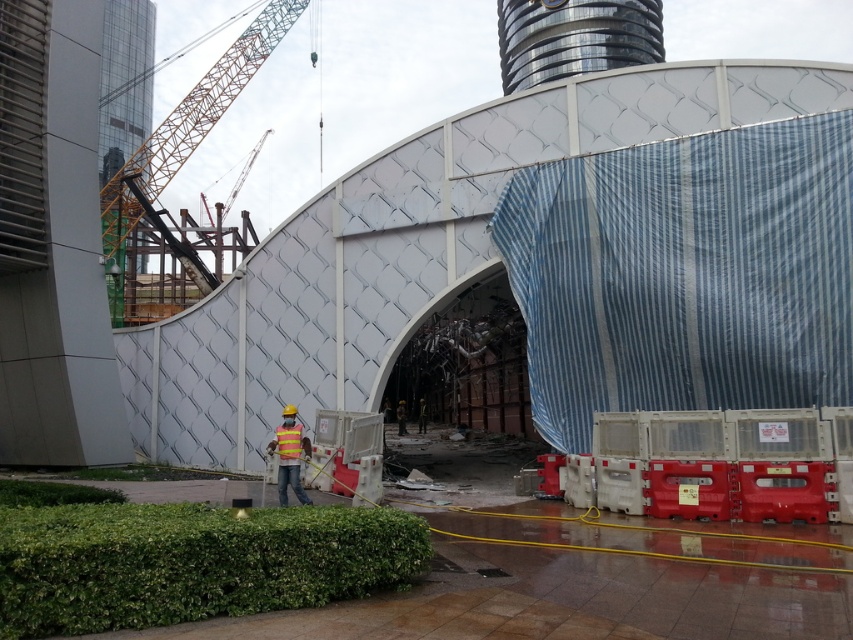
Question: Can you confirm if yellow reflective vest at center is wider than yellow reflective safety vest at center?

Choices:
 (A) no
 (B) yes

Answer: (B)

Question: Which point appears farthest from the camera in this image?

Choices:
 (A) (294, 442)
 (B) (280, 426)

Answer: (B)

Question: Which point appears farthest from the camera in this image?

Choices:
 (A) (310, 500)
 (B) (283, 424)

Answer: (A)

Question: Is yellow reflective vest at center to the right of yellow reflective safety vest at center from the viewer's perspective?

Choices:
 (A) yes
 (B) no

Answer: (B)

Question: Does yellow reflective vest at center appear on the left side of yellow reflective safety vest at center?

Choices:
 (A) yes
 (B) no

Answer: (A)